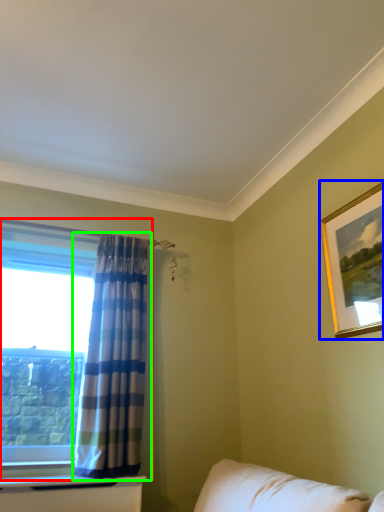
Question: Considering the real-world distances, which object is farthest from window (highlighted by a red box)? picture frame (highlighted by a blue box) or curtain (highlighted by a green box)?

Choices:
 (A) picture frame
 (B) curtain

Answer: (A)